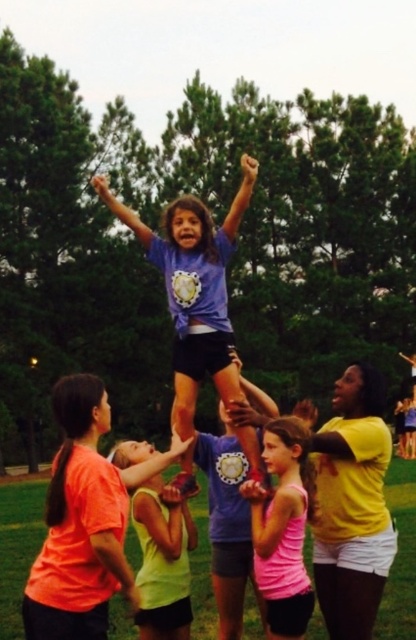
Question: Which object is the closest to the purple matte shirt at center?

Choices:
 (A) neon yellow tank top at center
 (B) pink matte shirt at center

Answer: (B)

Question: Which object is positioned closest to the pink matte shirt at center?

Choices:
 (A) purple matte shirt at center
 (B) neon yellow tank top at center

Answer: (A)

Question: Is pink matte shirt at center smaller than neon yellow tank top at center?

Choices:
 (A) no
 (B) yes

Answer: (B)

Question: Does purple matte shirt at center have a lesser width compared to pink matte shirt at center?

Choices:
 (A) yes
 (B) no

Answer: (B)

Question: Among these objects, which one is farthest from the camera?

Choices:
 (A) neon yellow tank top at center
 (B) purple matte shirt at center

Answer: (B)

Question: Is pink matte shirt at center further to camera compared to neon yellow tank top at center?

Choices:
 (A) no
 (B) yes

Answer: (A)